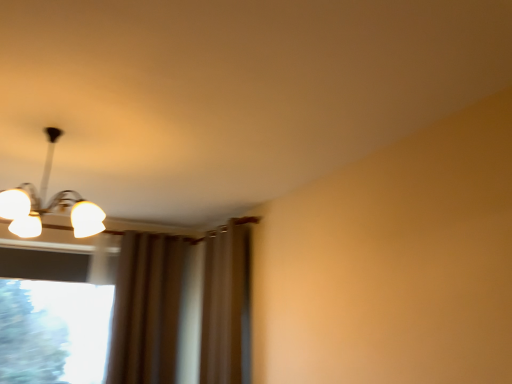
What do you see at coordinates (48, 204) in the screenshot?
I see `white glossy light fixture at upper left` at bounding box center [48, 204].

Find the location of a particular element. This screenshot has height=384, width=512. white glossy light fixture at upper left is located at coordinates (48, 204).

From the picture: Are brown fabric curtain at center and white glossy light fixture at upper left beside each other?

No, brown fabric curtain at center is not in contact with white glossy light fixture at upper left.

Considering the relative positions of brown fabric curtain at center and white glossy light fixture at upper left in the image provided, is brown fabric curtain at center to the left of white glossy light fixture at upper left from the viewer's perspective?

No, brown fabric curtain at center is not to the left of white glossy light fixture at upper left.

From the image's perspective, is brown fabric curtain at center above or below white glossy light fixture at upper left?

From the image's perspective, brown fabric curtain at center appears below white glossy light fixture at upper left.

At what (x,y) coordinates should I click in order to perform the action: click on lamp in front of the brown fabric curtain at center. Please return your answer as a coordinate pair (x, y). This screenshot has width=512, height=384. Looking at the image, I should click on coord(48,204).

Is white glossy light fixture at upper left touching transparent glass window at lower left?

white glossy light fixture at upper left and transparent glass window at lower left are clearly separated.

Between white glossy light fixture at upper left and transparent glass window at lower left, which one is positioned in front?

Positioned in front is white glossy light fixture at upper left.

Considering the positions of objects white glossy light fixture at upper left and transparent glass window at lower left in the image provided, who is more to the right, white glossy light fixture at upper left or transparent glass window at lower left?

Positioned to the right is white glossy light fixture at upper left.

Is white glossy light fixture at upper left facing away from brown fabric curtain at center?

No, white glossy light fixture at upper left is not facing the opposite direction of brown fabric curtain at center.

Identify the location of curtain that is behind the white glossy light fixture at upper left. (226, 304).

From the image's perspective, is white glossy light fixture at upper left on top of brown fabric curtain at center?

Indeed, from the image's perspective, white glossy light fixture at upper left is shown above brown fabric curtain at center.

From their relative heights in the image, would you say white glossy light fixture at upper left is taller or shorter than brown fabric curtain at center?

Clearly, white glossy light fixture at upper left is shorter compared to brown fabric curtain at center.

Does transparent glass window at lower left have a lesser width compared to white glossy light fixture at upper left?

Indeed, transparent glass window at lower left has a lesser width compared to white glossy light fixture at upper left.

Which of these two, transparent glass window at lower left or white glossy light fixture at upper left, stands taller?

With more height is transparent glass window at lower left.

Is white glossy light fixture at upper left at the back of transparent glass window at lower left?

No, transparent glass window at lower left is not facing the opposite direction of white glossy light fixture at upper left.

Can you tell me how much transparent glass window at lower left and white glossy light fixture at upper left differ in facing direction?

There is a 2.68-degree angle between the facing directions of transparent glass window at lower left and white glossy light fixture at upper left.

Looking at this image, how much distance is there between transparent glass window at lower left and brown fabric curtain at center?

transparent glass window at lower left is 4.24 feet from brown fabric curtain at center.

In the image, there is a brown fabric curtain at center. Where is `window below it (from a real-world perspective)`? window below it (from a real-world perspective) is located at coordinates (53, 331).

Are transparent glass window at lower left and brown fabric curtain at center far apart?

transparent glass window at lower left is far away from brown fabric curtain at center.

From a real-world perspective, is transparent glass window at lower left on top of brown fabric curtain at center?

Actually, transparent glass window at lower left is physically below brown fabric curtain at center in the real world.

What's the angular difference between brown fabric curtain at center and transparent glass window at lower left's facing directions?

brown fabric curtain at center and transparent glass window at lower left are facing 88.7 degrees away from each other.

From a real-world perspective, which object stands above the other?

brown fabric curtain at center.

Consider the image. Which is correct: brown fabric curtain at center is inside transparent glass window at lower left, or outside of it?

brown fabric curtain at center is not enclosed by transparent glass window at lower left.

Which object is wider, brown fabric curtain at center or transparent glass window at lower left?

brown fabric curtain at center.

Image resolution: width=512 pixels, height=384 pixels. I want to click on lamp in front of the brown fabric curtain at center, so [x=48, y=204].

Locate an element on the screen. This screenshot has height=384, width=512. window that is under the white glossy light fixture at upper left (from a real-world perspective) is located at coordinates (53, 331).

Estimate the real-world distances between objects in this image. Which object is closer to brown fabric curtain at center, white glossy light fixture at upper left or transparent glass window at lower left?

transparent glass window at lower left is closer to brown fabric curtain at center.

When comparing their distances from white glossy light fixture at upper left, does brown fabric curtain at center or transparent glass window at lower left seem further?

Based on the image, brown fabric curtain at center appears to be further to white glossy light fixture at upper left.

When comparing their distances from brown fabric curtain at center, does transparent glass window at lower left or white glossy light fixture at upper left seem closer?

Among the two, transparent glass window at lower left is located nearer to brown fabric curtain at center.

Which object lies nearer to the anchor point transparent glass window at lower left, brown fabric curtain at center or white glossy light fixture at upper left?

white glossy light fixture at upper left is closer to transparent glass window at lower left.

Based on the photo, looking at the image, which one is located closer to transparent glass window at lower left, white glossy light fixture at upper left or brown fabric curtain at center?

white glossy light fixture at upper left.

Looking at the image, which one is located further to white glossy light fixture at upper left, transparent glass window at lower left or brown fabric curtain at center?

brown fabric curtain at center lies further to white glossy light fixture at upper left than the other object.

Identify the location of curtain between white glossy light fixture at upper left and transparent glass window at lower left along the z-axis. The height and width of the screenshot is (384, 512). (226, 304).